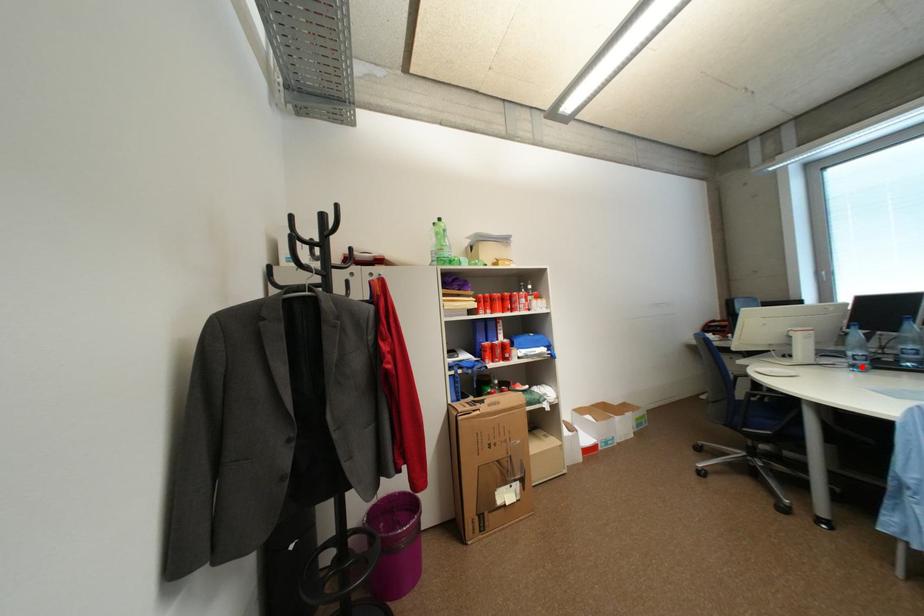
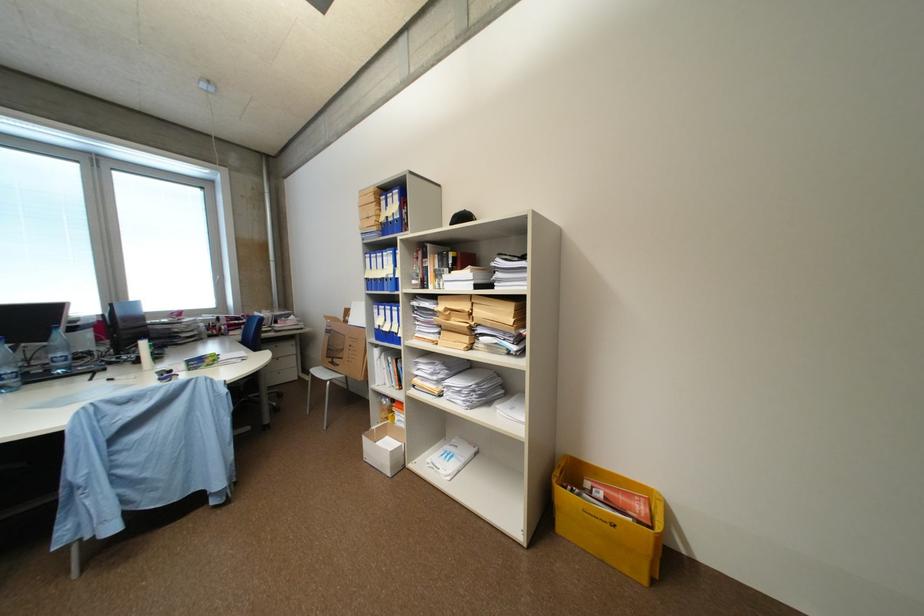
Find the pixel in the second image that matches the highlighted location in the first image.

(10, 389)